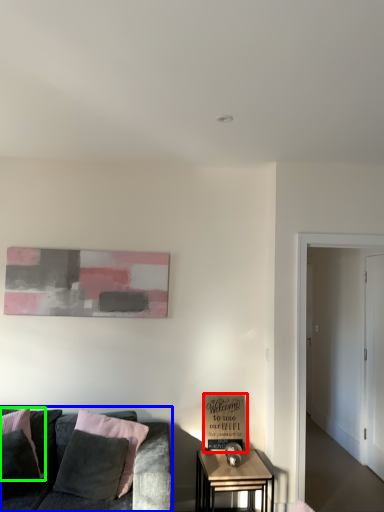
Question: Which object is the farthest from cardboard box (highlighted by a red box)? Choose among these: studio couch (highlighted by a blue box) or pillow (highlighted by a green box).

Choices:
 (A) studio couch
 (B) pillow

Answer: (B)